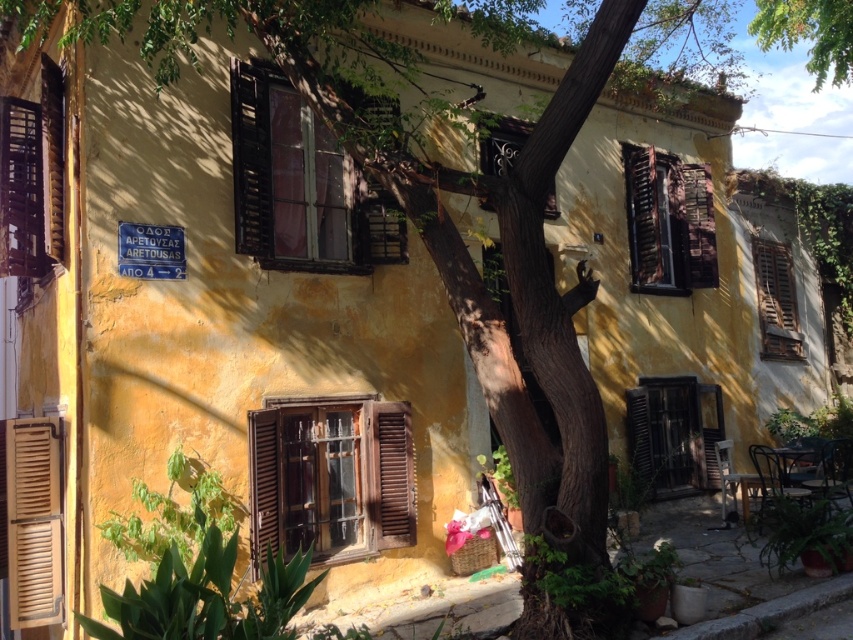
You are standing in front of the yellow building and want to locate the wooden shutters at center. According to the coordinates provided, where exactly are they positioned?

The wooden shutters at center are positioned at coordinates point (300, 186).

You are standing in front of the yellow building and notice two wooden structures. The first is the wooden shutters at center, and the second is the wooden at left. Which of these two wooden structures is positioned to the right side from your viewpoint?

The wooden shutters at center are positioned to the right of the wooden at left.

You are a painter standing in front of the yellow building. You want to paint the wooden shutters at center and the wooden at left. Which one should you focus on if you want to paint the larger wooden object?

The wooden shutters at center is bigger than wooden at left, so you should focus on the wooden shutters at center.